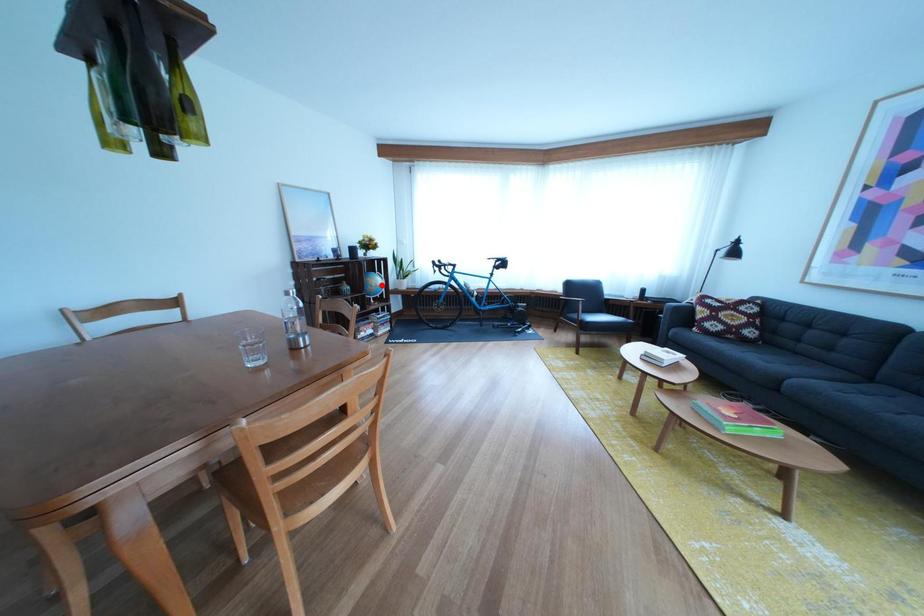
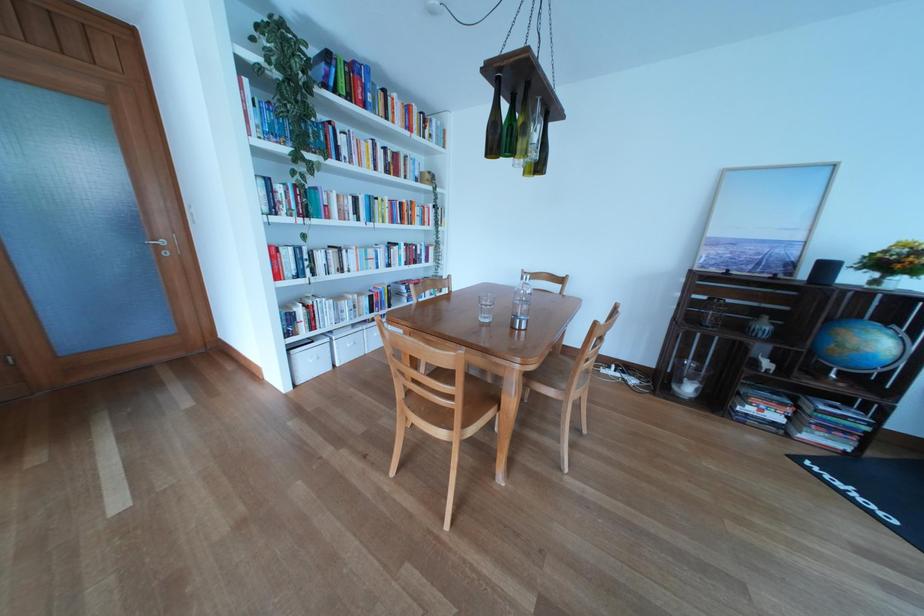
Question: I am providing you with two images of the same scene from different viewpoints. In image1, a red point is highlighted. Considering the same 3D point in image2, which of the following is correct?

Choices:
 (A) It is closer
 (B) It is farther

Answer: (B)